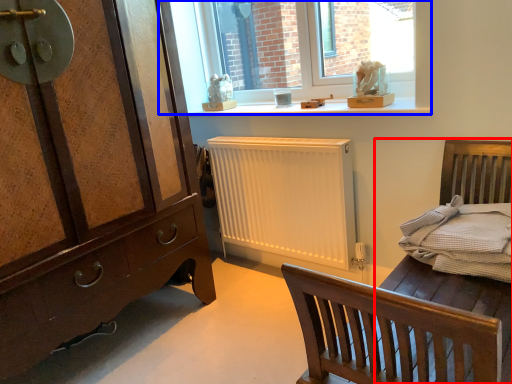
Question: Which object is further to the camera taking this photo, bed frame (highlighted by a red box) or window (highlighted by a blue box)?

Choices:
 (A) bed frame
 (B) window

Answer: (B)